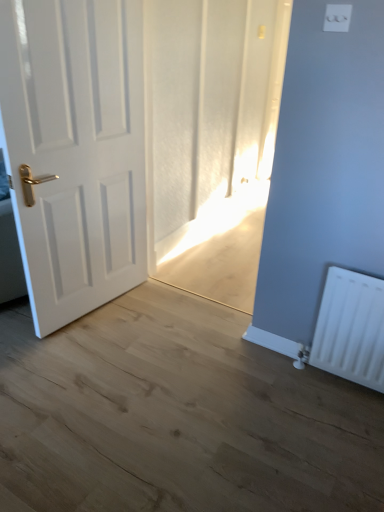
Question: Can you confirm if white plastic light switch at upper center is wider than white matte door at left?

Choices:
 (A) no
 (B) yes

Answer: (A)

Question: Considering the relative sizes of white plastic light switch at upper center and white matte door at left in the image provided, is white plastic light switch at upper center shorter than white matte door at left?

Choices:
 (A) no
 (B) yes

Answer: (B)

Question: Is white plastic light switch at upper center at the left side of white matte door at left?

Choices:
 (A) yes
 (B) no

Answer: (B)

Question: Is white plastic light switch at upper center directly adjacent to white matte door at left?

Choices:
 (A) no
 (B) yes

Answer: (A)

Question: From the image's perspective, would you say white plastic light switch at upper center is positioned over white matte door at left?

Choices:
 (A) yes
 (B) no

Answer: (A)

Question: Is white plastic light switch at upper center smaller than white matte door at left?

Choices:
 (A) yes
 (B) no

Answer: (A)

Question: Is white plastic light switch at upper center a part of white matte door at left?

Choices:
 (A) yes
 (B) no

Answer: (B)

Question: Is white matte door at left next to white plastic light switch at upper center and touching it?

Choices:
 (A) no
 (B) yes

Answer: (A)

Question: Is white matte door at left facing away from white plastic light switch at upper center?

Choices:
 (A) no
 (B) yes

Answer: (A)

Question: Could you tell me if white matte door at left is facing white plastic light switch at upper center?

Choices:
 (A) yes
 (B) no

Answer: (A)

Question: From a real-world perspective, is white matte door at left below white plastic light switch at upper center?

Choices:
 (A) no
 (B) yes

Answer: (B)

Question: Is white matte door at left positioned before white plastic light switch at upper center?

Choices:
 (A) yes
 (B) no

Answer: (B)

Question: Does white matte door at left have a larger size compared to white plastic radiator at lower right?

Choices:
 (A) no
 (B) yes

Answer: (B)